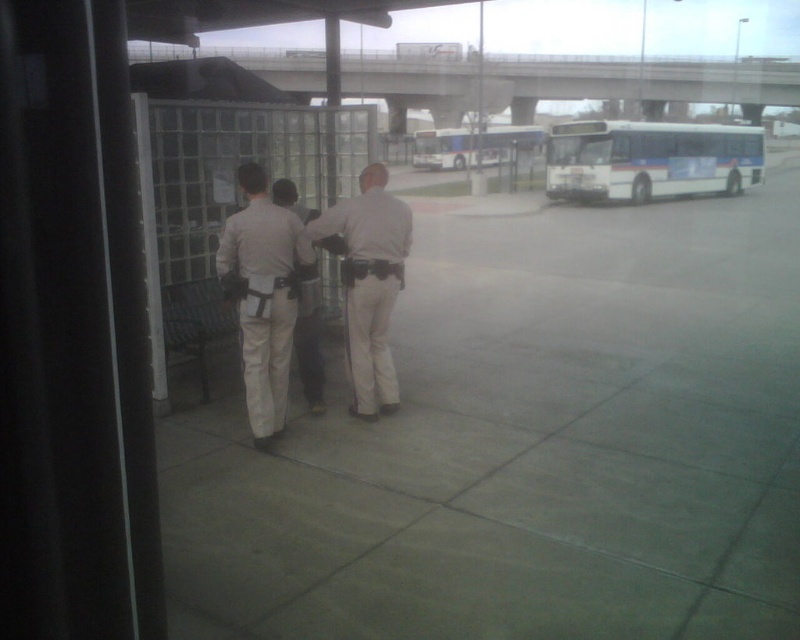
Between point (214, 524) and point (448, 132), which one is positioned in front?

Point (214, 524)

Does point (312, 637) come closer to viewer compared to point (444, 140)?

Yes, it is.

The height and width of the screenshot is (640, 800). I want to click on matte concrete sidewalk at center, so click(528, 445).

Does white matte bus at right appear over khaki uniform pants at center?

Correct, white matte bus at right is located above khaki uniform pants at center.

Is point (648, 163) farther from viewer compared to point (318, 280)?

Yes, it is behind point (318, 280).

The image size is (800, 640). Find the location of `white matte bus at right`. white matte bus at right is located at coordinates (650, 160).

Is white matte bus at right below matte khaki pants at center?

Actually, white matte bus at right is above matte khaki pants at center.

Who is lower down, white matte bus at right or matte khaki pants at center?

Positioned lower is matte khaki pants at center.

Is point (698, 164) in front of point (376, 280)?

No.

The image size is (800, 640). In order to click on white matte bus at right in this screenshot , I will do `click(650, 160)`.